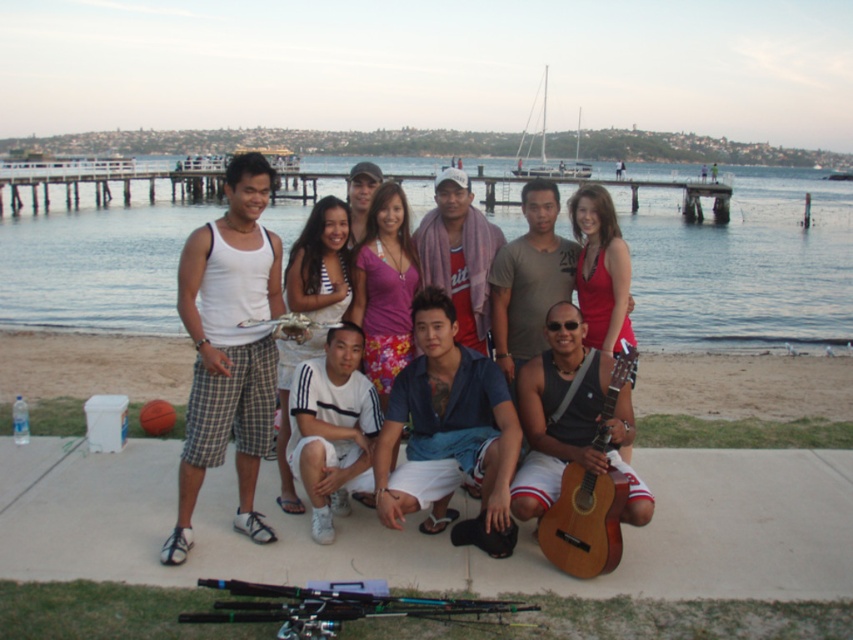
You are a photographer setting up for a group photo at the beach. You notice the beige sand at lower center and the blue cotton shirt at center. Which object is taller in the scene?

The blue cotton shirt at center is taller than the beige sand at lower center.